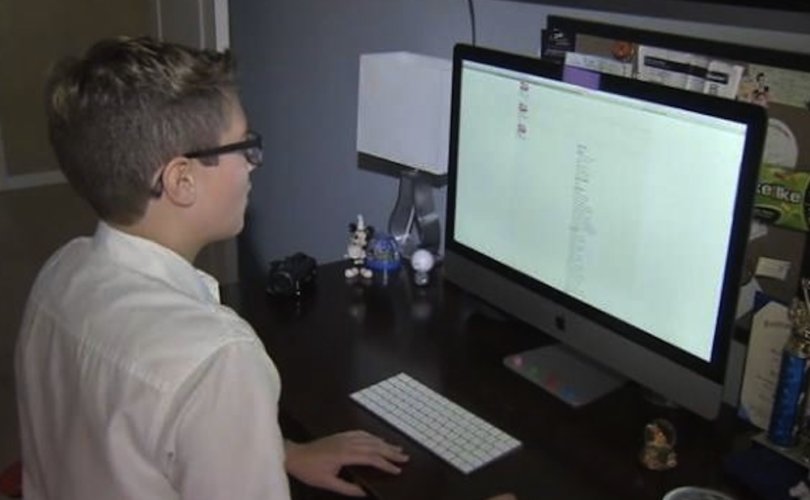
At what (x,y) coordinates should I click in order to perform the action: click on computer monitor. Please return your answer as a coordinate pair (x, y). Looking at the image, I should click on (606, 242).